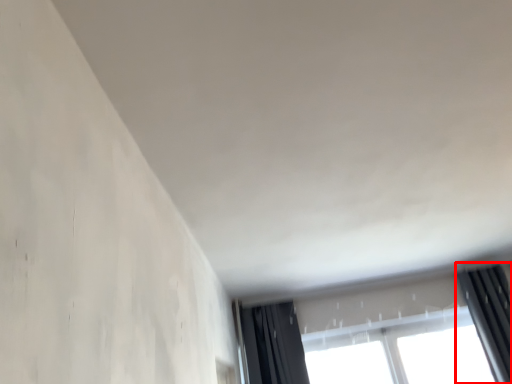
Question: Considering the relative positions of curtain (annotated by the red box) and window in the image provided, where is curtain (annotated by the red box) located with respect to the staircase?

Choices:
 (A) left
 (B) right

Answer: (B)